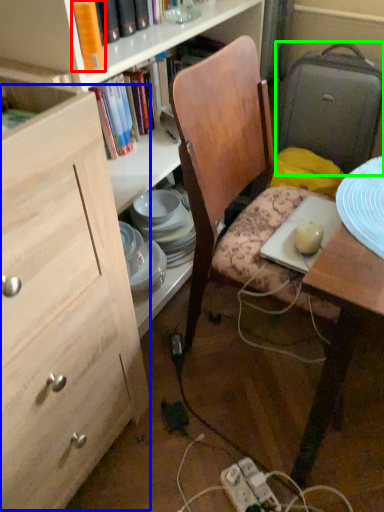
Question: Considering the real-world distances, which object is closest to book (highlighted by a red box)? cabinetry (highlighted by a blue box) or suitcase (highlighted by a green box).

Choices:
 (A) cabinetry
 (B) suitcase

Answer: (A)